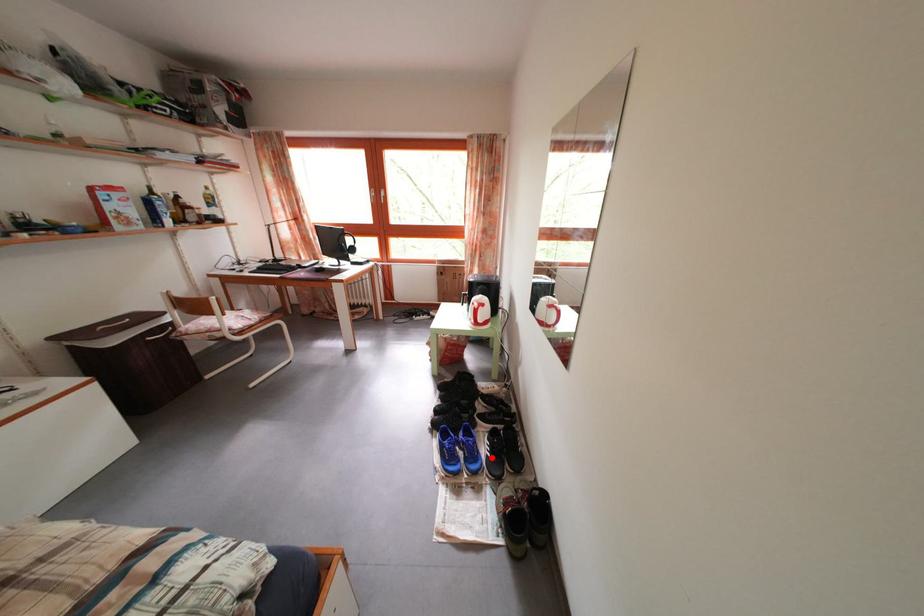
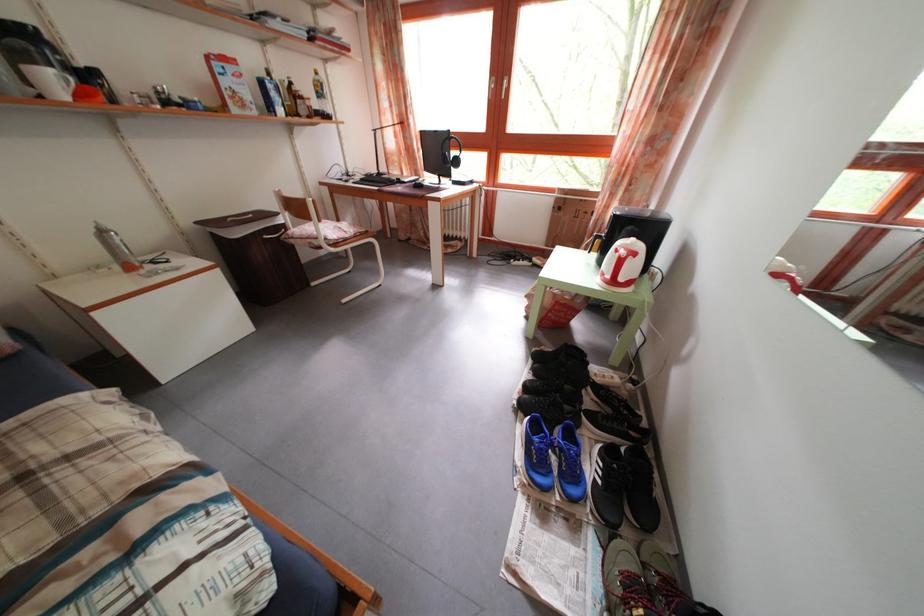
Question: I am providing you with two images of the same scene from different viewpoints. In image1, a red point is highlighted. Considering the same 3D point in image2, which of the following is correct?

Choices:
 (A) It is closer
 (B) It is farther

Answer: (B)